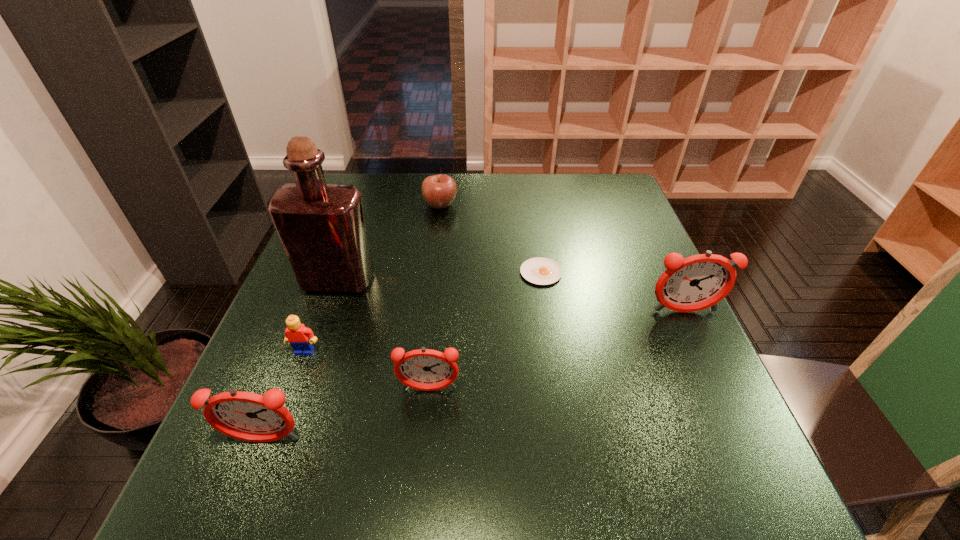
Locate an element on the screen. This screenshot has width=960, height=540. vacant space at the far right corner of the desktop is located at coordinates (619, 204).

The image size is (960, 540). In the image, there is a desktop. What are the coordinates of `vacant space at the near right corner` in the screenshot? It's located at (657, 450).

Locate an element on the screen. This screenshot has height=540, width=960. free point between the third tallest object and the liquor is located at coordinates (300, 360).

Locate an element on the screen. This screenshot has width=960, height=540. vacant space that is in between the sixth tallest object and the Lego is located at coordinates (372, 278).

Identify the location of free space between the fourth tallest object and the tallest object. The image size is (960, 540). (383, 335).

At what (x,y) coordinates should I click in order to perform the action: click on free space between the rightmost object and the nearest object. Please return your answer as a coordinate pair (x, y). Looking at the image, I should click on (473, 376).

I want to click on empty space that is in between the apple and the leftmost alarm clock, so click(352, 322).

Find the location of a particular element. empty space that is in between the liquor and the sixth object from left to right is located at coordinates (440, 276).

I want to click on free space between the liquor and the egg yolk, so click(x=440, y=276).

Identify the location of free area in between the second alarm clock from left to right and the sixth tallest object. This screenshot has width=960, height=540. (435, 297).